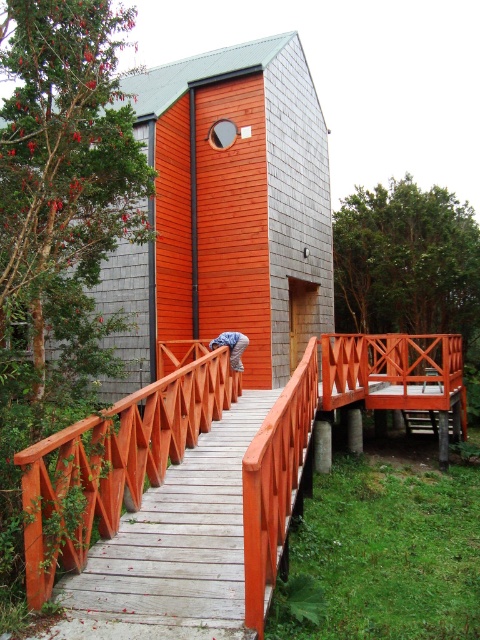
Between wooden bridge at center and matte orange wooden rail at center, which one is positioned higher?

wooden bridge at center is above.

Which is in front, point (372, 388) or point (190, 390)?

Point (190, 390)

This screenshot has width=480, height=640. I want to click on wooden bridge at center, so click(331, 419).

The height and width of the screenshot is (640, 480). Identify the location of wooden bridge at center. (331, 419).